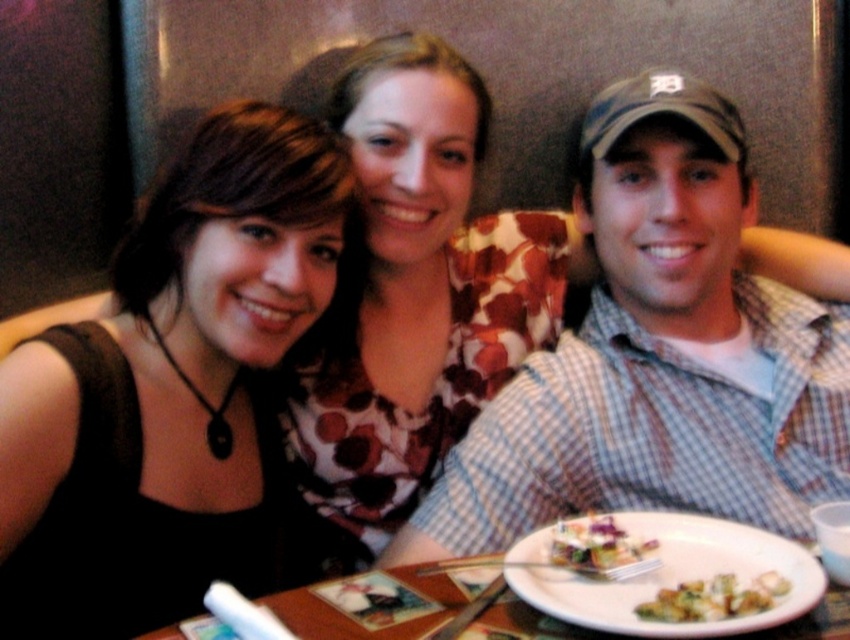
Question: Which object appears closest to the camera in this image?

Choices:
 (A) green leafy vegetables at center
 (B) green leafy salad at center
 (C) checkered fabric shirt at center

Answer: (A)

Question: Can you confirm if black fabric dress at left is positioned above white plate at center?

Choices:
 (A) no
 (B) yes

Answer: (B)

Question: Which point is farther to the camera?

Choices:
 (A) (676, 616)
 (B) (525, 604)
 (C) (797, 461)
 (D) (517, 557)

Answer: (C)

Question: Does white plate at center have a larger size compared to green leafy vegetables at center?

Choices:
 (A) no
 (B) yes

Answer: (B)

Question: Does white ceramic plate at center appear on the left side of white plate at center?

Choices:
 (A) yes
 (B) no

Answer: (B)

Question: Which point appears closest to the camera in this image?

Choices:
 (A) (677, 602)
 (B) (684, 326)

Answer: (A)